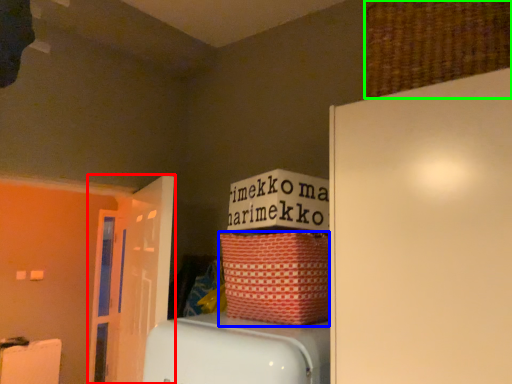
Question: Considering the real-world distances, which object is farthest from door (highlighted by a red box)? basket (highlighted by a blue box) or basket (highlighted by a green box)?

Choices:
 (A) basket
 (B) basket

Answer: (B)